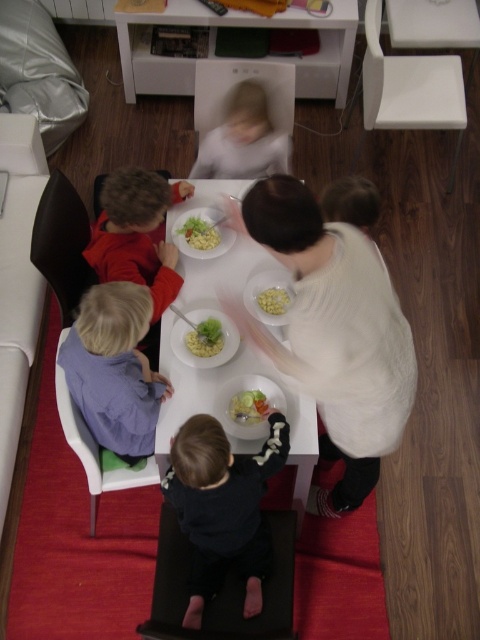
Question: Is dark blue sweater at lower center above smooth yellow pasta at center?

Choices:
 (A) yes
 (B) no

Answer: (B)

Question: Among these objects, which one is farthest from the camera?

Choices:
 (A) smooth white shirt at upper center
 (B) smooth yellow pasta at center
 (C) yellow matte pasta at center

Answer: (A)

Question: Does dark blue sweater at lower center have a greater width compared to white glossy table at center?

Choices:
 (A) no
 (B) yes

Answer: (A)

Question: Considering the relative positions of translucent plastic bowl at center and yellow matte pasta bowl at center in the image provided, where is translucent plastic bowl at center located with respect to yellow matte pasta bowl at center?

Choices:
 (A) right
 (B) left

Answer: (A)

Question: Which object appears closest to the camera in this image?

Choices:
 (A) smooth white shirt at upper center
 (B) yellow matte pasta at center

Answer: (B)

Question: Which object is farther from the camera taking this photo?

Choices:
 (A) smooth yellow pasta at center
 (B) yellow matte pasta at center
 (C) green matte salad bowl at center
 (D) smooth plastic container at center

Answer: (A)